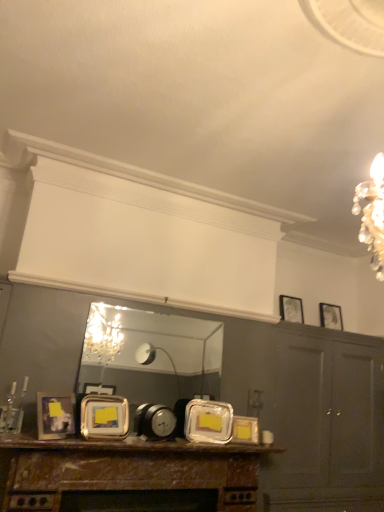
Locate an element on the screen. The height and width of the screenshot is (512, 384). blank space to the left of matte silver picture frame at lower left, which ranks as the fifth picture frame in back-to-front order is located at coordinates (20, 436).